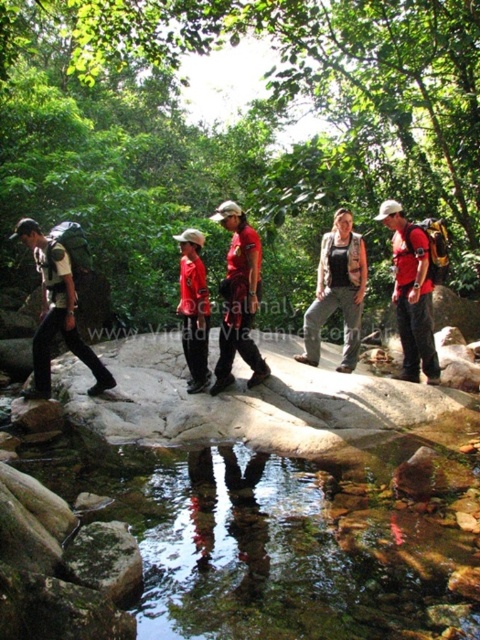
You are a hiker who wants to know if the matte black backpack at left can be placed on top of the matte red shirt at center without falling over. Based on their sizes, what do you think?

The matte black backpack at left is taller than the matte red shirt at center, so placing it on top might cause instability and could result in the backpack falling over.

You are a hiker navigating through the forest and want to reach a specific point. You have two options to choose from, point A at coordinates point (316, 312) and point B at coordinates point (180, 250). Which point is closer to your current position if you are standing behind point B?

Point A at coordinates point (316, 312) is in front of point B at coordinates point (180, 250). Since you are standing behind point B, point A would be farther away from your current position compared to point B. Therefore, point B is closer to your current position.